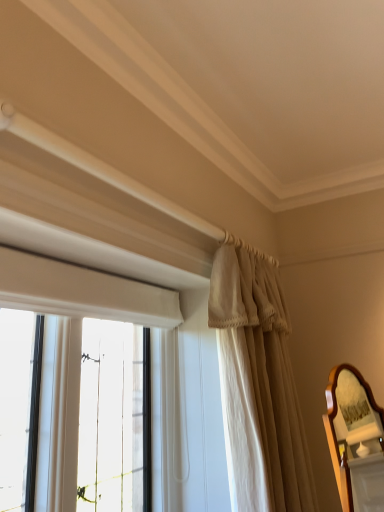
This screenshot has width=384, height=512. What do you see at coordinates (354, 435) in the screenshot? I see `wooden mirror at right` at bounding box center [354, 435].

Image resolution: width=384 pixels, height=512 pixels. What are the coordinates of `wooden mirror at right` in the screenshot? It's located at (354, 435).

Identify the location of beige fabric curtain at upper right. (258, 387).

Describe the element at coordinates (258, 387) in the screenshot. The image size is (384, 512). I see `beige fabric curtain at upper right` at that location.

Locate an element on the screen. The width and height of the screenshot is (384, 512). wooden mirror at right is located at coordinates (354, 435).

Considering the relative positions of wooden mirror at right and beige fabric curtain at upper right in the image provided, is wooden mirror at right to the left of beige fabric curtain at upper right from the viewer's perspective?

No, wooden mirror at right is not to the left of beige fabric curtain at upper right.

Considering the relative positions of wooden mirror at right and beige fabric curtain at upper right in the image provided, is wooden mirror at right in front of beige fabric curtain at upper right?

Yes, the depth of wooden mirror at right is less than that of beige fabric curtain at upper right.

Which point is more forward, (378, 439) or (251, 474)?

The point (251, 474) is closer.

Based on the photo, from the image's perspective, is wooden mirror at right located above or below beige fabric curtain at upper right?

From the image's perspective, wooden mirror at right appears below beige fabric curtain at upper right.

From a real-world perspective, is wooden mirror at right positioned under beige fabric curtain at upper right based on gravity?

Indeed, from a real-world perspective, wooden mirror at right is positioned beneath beige fabric curtain at upper right.

Does wooden mirror at right have a greater width compared to beige fabric curtain at upper right?

No, wooden mirror at right is not wider than beige fabric curtain at upper right.

Can you confirm if wooden mirror at right is taller than beige fabric curtain at upper right?

No, wooden mirror at right is not taller than beige fabric curtain at upper right.

Who is bigger, wooden mirror at right or beige fabric curtain at upper right?

With larger size is beige fabric curtain at upper right.

Is wooden mirror at right completely or partially outside of beige fabric curtain at upper right?

Yes, wooden mirror at right is located beyond the bounds of beige fabric curtain at upper right.

Is wooden mirror at right far from beige fabric curtain at upper right?

That's right, there is a large distance between wooden mirror at right and beige fabric curtain at upper right.

Is wooden mirror at right looking in the opposite direction of beige fabric curtain at upper right?

That's right, wooden mirror at right is facing away from beige fabric curtain at upper right.

How different are the orientations of wooden mirror at right and beige fabric curtain at upper right in degrees?

64.4 degrees separate the facing orientations of wooden mirror at right and beige fabric curtain at upper right.

Where is `curtain on the left of wooden mirror at right`? curtain on the left of wooden mirror at right is located at coordinates (258, 387).

Is beige fabric curtain at upper right at the left side of wooden mirror at right?

Yes, beige fabric curtain at upper right is to the left of wooden mirror at right.

In the image, is beige fabric curtain at upper right positioned in front of or behind wooden mirror at right?

Visually, beige fabric curtain at upper right is located behind wooden mirror at right.

Which is less distant, (225, 261) or (351, 395)?

Point (225, 261).

From the image's perspective, which one is positioned lower, beige fabric curtain at upper right or wooden mirror at right?

wooden mirror at right.

From a real-world perspective, is beige fabric curtain at upper right below wooden mirror at right?

No, from a real-world perspective, beige fabric curtain at upper right is not beneath wooden mirror at right.

Which of these two, beige fabric curtain at upper right or wooden mirror at right, is wider?

beige fabric curtain at upper right.

Can you confirm if beige fabric curtain at upper right is shorter than wooden mirror at right?

No, beige fabric curtain at upper right is not shorter than wooden mirror at right.

Does beige fabric curtain at upper right have a larger size compared to wooden mirror at right?

Correct, beige fabric curtain at upper right is larger in size than wooden mirror at right.

Is beige fabric curtain at upper right not within wooden mirror at right?

Yes, beige fabric curtain at upper right is not within wooden mirror at right.

Is beige fabric curtain at upper right not close to wooden mirror at right?

beige fabric curtain at upper right is far away from wooden mirror at right.

Is beige fabric curtain at upper right turned away from wooden mirror at right?

That's not correct — beige fabric curtain at upper right is not looking away from wooden mirror at right.

The height and width of the screenshot is (512, 384). What are the coordinates of `curtain behind the wooden mirror at right` in the screenshot? It's located at click(258, 387).

At what (x,y) coordinates should I click in order to perform the action: click on mirror in front of the beige fabric curtain at upper right. Please return your answer as a coordinate pair (x, y). Image resolution: width=384 pixels, height=512 pixels. Looking at the image, I should click on (354, 435).

I want to click on curtain above the wooden mirror at right (from a real-world perspective), so click(258, 387).